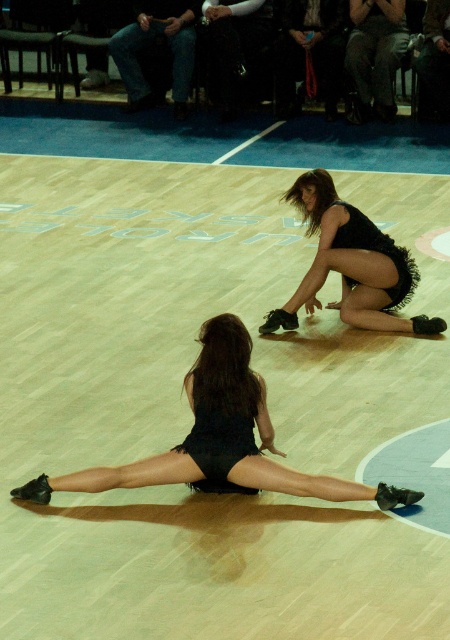
Question: Can you confirm if black fringed skirt at lower center is positioned below black sequined dress at lower center?

Choices:
 (A) yes
 (B) no

Answer: (B)

Question: Does black fringed skirt at lower center have a smaller size compared to black sequined dress at lower center?

Choices:
 (A) no
 (B) yes

Answer: (A)

Question: Which point appears farthest from the camera in this image?

Choices:
 (A) 355,240
 (B) 394,243
 (C) 203,406

Answer: (B)

Question: Which point is closer to the camera taking this photo?

Choices:
 (A) (205, 454)
 (B) (301, 202)
 (C) (225, 385)

Answer: (A)

Question: Estimate the real-world distances between objects in this image. Which object is farther from the black sequined dress at lower center?

Choices:
 (A) black fringed skirt at center
 (B) black feathered skirt at center

Answer: (A)

Question: Can you confirm if black sequined dress at lower center is thinner than black fringed skirt at center?

Choices:
 (A) yes
 (B) no

Answer: (A)